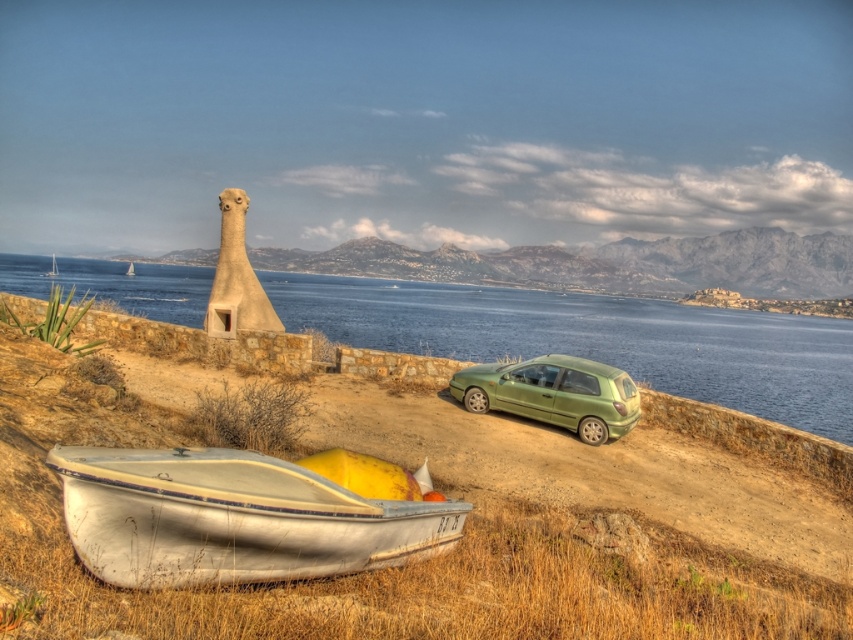
Question: Which of the following is the farthest from the observer?

Choices:
 (A) white plastic sailboat at upper left
 (B) blue water at center
 (C) green matte hatchback at center
 (D) white painted wood boat at lower left

Answer: (A)

Question: Is blue water at center to the right of white painted wood boat at lower left from the viewer's perspective?

Choices:
 (A) yes
 (B) no

Answer: (B)

Question: Is blue water at center wider than white painted wood boat at lower left?

Choices:
 (A) no
 (B) yes

Answer: (B)

Question: Which point appears farthest from the camera in this image?

Choices:
 (A) (538, 417)
 (B) (32, 296)

Answer: (B)

Question: Which of the following is the closest to the observer?

Choices:
 (A) white painted wood boat at lower left
 (B) blue water at center
 (C) white plastic sailboat at upper left

Answer: (A)

Question: Is green matte hatchback at center bigger than white plastic sailboat at upper left?

Choices:
 (A) yes
 (B) no

Answer: (B)